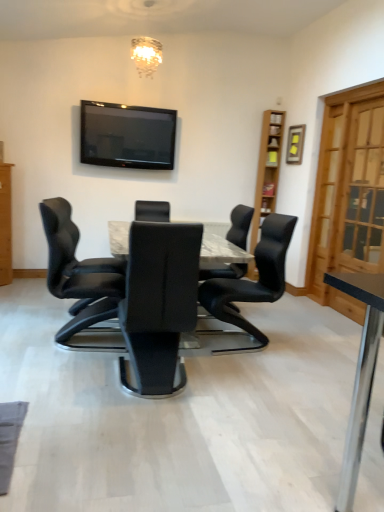
Measure the distance between point (364,177) and camera.

The distance of point (364,177) from camera is 3.88 meters.

What are the coordinates of `wooden bookshelf at upper right` in the screenshot? It's located at (267, 169).

Identify the location of marble table at center. (221, 251).

Where is `black leather chair at center, which is the second chair in left-to-right order`? black leather chair at center, which is the second chair in left-to-right order is located at coordinates (240, 225).

Find the location of a particular element. The image size is (384, 512). clear glass door at right is located at coordinates (361, 193).

Considering the relative positions of clear glass door at right and marble table at center in the image provided, is clear glass door at right to the left of marble table at center from the viewer's perspective?

In fact, clear glass door at right is to the right of marble table at center.

Is clear glass door at right placed right next to marble table at center?

They are not placed beside each other.

You are a GUI agent. You are given a task and a screenshot of the screen. Output one action in this format:
    pyautogui.click(x=<x>, y=<y>)
    Task: Click on the desk in front of the clear glass door at right
    This screenshot has height=512, width=384.
    Given the screenshot: What is the action you would take?
    pyautogui.click(x=221, y=251)

Is flat-screen black at upper center looking in the opposite direction of black leather chair at center, acting as the 2th chair starting from the right?

No.

Can you confirm if flat-screen black at upper center is positioned to the left of black leather chair at center, which is the second chair in left-to-right order?

Indeed, flat-screen black at upper center is positioned on the left side of black leather chair at center, which is the second chair in left-to-right order.

Would you consider flat-screen black at upper center to be distant from black leather chair at center, acting as the 2th chair starting from the right?

Yes, flat-screen black at upper center and black leather chair at center, acting as the 2th chair starting from the right, are located far from each other.

Is the surface of wooden bookshelf at upper right in direct contact with black leather chair at center, the third chair when ordered from left to right?

No, wooden bookshelf at upper right is not in contact with black leather chair at center, the third chair when ordered from left to right.

Based on the photo, is wooden bookshelf at upper right situated inside black leather chair at center, which is the first chair from right to left, or outside?

wooden bookshelf at upper right is outside black leather chair at center, which is the first chair from right to left.

Which is farther from the camera, (277, 159) or (234, 296)?

The point (277, 159) is more distant.

From the image's perspective, which is below, wooden bookshelf at upper right or black leather chair at center, which is the first chair from right to left?

black leather chair at center, which is the first chair from right to left, is shown below in the image.

Can you confirm if light brown wooden cabinet at left is bigger than wooden bookshelf at upper right?

Yes, light brown wooden cabinet at left is bigger than wooden bookshelf at upper right.

Which object is closer to the camera, light brown wooden cabinet at left or wooden bookshelf at upper right?

light brown wooden cabinet at left is in front.

Can you confirm if light brown wooden cabinet at left is taller than wooden bookshelf at upper right?

Correct, light brown wooden cabinet at left is much taller as wooden bookshelf at upper right.

Is light brown wooden cabinet at left facing away from wooden bookshelf at upper right?

No, light brown wooden cabinet at left is not facing the opposite direction of wooden bookshelf at upper right.

Are wooden bookshelf at upper right and marble table at center far apart?

Indeed, wooden bookshelf at upper right is not near marble table at center.

How many degrees apart are the facing directions of wooden bookshelf at upper right and marble table at center?

The angular difference between wooden bookshelf at upper right and marble table at center is 176 degrees.

Can we say wooden bookshelf at upper right lies outside marble table at center?

wooden bookshelf at upper right lies outside marble table at center's area.

Can you confirm if wooden bookshelf at upper right is bigger than marble table at center?

Incorrect, wooden bookshelf at upper right is not larger than marble table at center.

Between black leather chair at center, which is the first chair from right to left, and flat-screen black at upper center, which one is positioned behind?

flat-screen black at upper center.

Considering the positions of points (259, 295) and (152, 112), is point (259, 295) farther from camera compared to point (152, 112)?

No, it is not.

Which of these two, black leather chair at center, the third chair when ordered from left to right, or flat-screen black at upper center, is thinner?

flat-screen black at upper center is thinner.

Is black leather chair at center, which is the first chair from right to left, wider than marble table at center?

In fact, black leather chair at center, which is the first chair from right to left, might be narrower than marble table at center.

Can marble table at center be found inside black leather chair at center, which is the first chair from right to left?

That's incorrect, marble table at center is not inside black leather chair at center, which is the first chair from right to left.

Relative to marble table at center, is black leather chair at center, which is the first chair from right to left, in front or behind?

black leather chair at center, which is the first chair from right to left, is positioned farther from the viewer than marble table at center.

Find the location of a particular element. glass door on the right of marble table at center is located at coordinates (361, 193).

From the image's perspective, count 2nd chairs downward from the flat-screen black at upper center and point to it. Please provide its 2D coordinates.

[(240, 225)]

Looking at the image, which one is located further to black leather chair at center, acting as the 2th chair starting from the right, light brown wooden cabinet at left or marble table at center?

light brown wooden cabinet at left is positioned further to the anchor black leather chair at center, acting as the 2th chair starting from the right.

Which object lies further to the anchor point wooden bookshelf at upper right, clear glass door at right or light brown wooden cabinet at left?

Based on the image, light brown wooden cabinet at left appears to be further to wooden bookshelf at upper right.

Based on their spatial positions, is light brown wooden cabinet at left or flat-screen black at upper center closer to marble table at center?

flat-screen black at upper center.

Estimate the real-world distances between objects in this image. Which object is further from marble table at center, flat-screen black at upper center or wooden bookshelf at upper right?

wooden bookshelf at upper right is further to marble table at center.

Looking at this image, based on their spatial positions, is clear glass door at right or wooden bookshelf at upper right closer to black leather chair at center, the third chair when ordered from left to right?

clear glass door at right.

Estimate the real-world distances between objects in this image. Which object is closer to black leather chair at center, which is the second chair in left-to-right order, black leather chair at center, the third chair when ordered from left to right, or flat-screen black at upper center?

Based on the image, black leather chair at center, the third chair when ordered from left to right, appears to be nearer to black leather chair at center, which is the second chair in left-to-right order.

Which object lies further to the anchor point black leather chair at center, which is the first chair from right to left, black leather chair at center, acting as the 2th chair starting from the right, or light brown wooden cabinet at left?

light brown wooden cabinet at left is positioned further to the anchor black leather chair at center, which is the first chair from right to left.

When comparing their distances from black leather chair at center, acting as the 2th chair starting from the right, does black leather chair at left, arranged as the 1th chair when viewed from the left, or marble table at center seem closer?

The object closer to black leather chair at center, acting as the 2th chair starting from the right, is marble table at center.

Identify the location of desk situated between light brown wooden cabinet at left and black leather chair at center, the third chair when ordered from left to right, from left to right. (221, 251).

You are a GUI agent. You are given a task and a screenshot of the screen. Output one action in this format:
    pyautogui.click(x=<x>, y=<y>)
    Task: Click on the dresser between flat-screen black at upper center and clear glass door at right in the horizontal direction
    Image resolution: width=384 pixels, height=512 pixels.
    Given the screenshot: What is the action you would take?
    pyautogui.click(x=267, y=169)

Find the location of a particular element. chair situated between light brown wooden cabinet at left and marble table at center from left to right is located at coordinates (76, 274).

What are the coordinates of `dresser located between black leather chair at left, marked as the third chair in a right-to-left arrangement, and clear glass door at right in the left-right direction` in the screenshot? It's located at (267, 169).